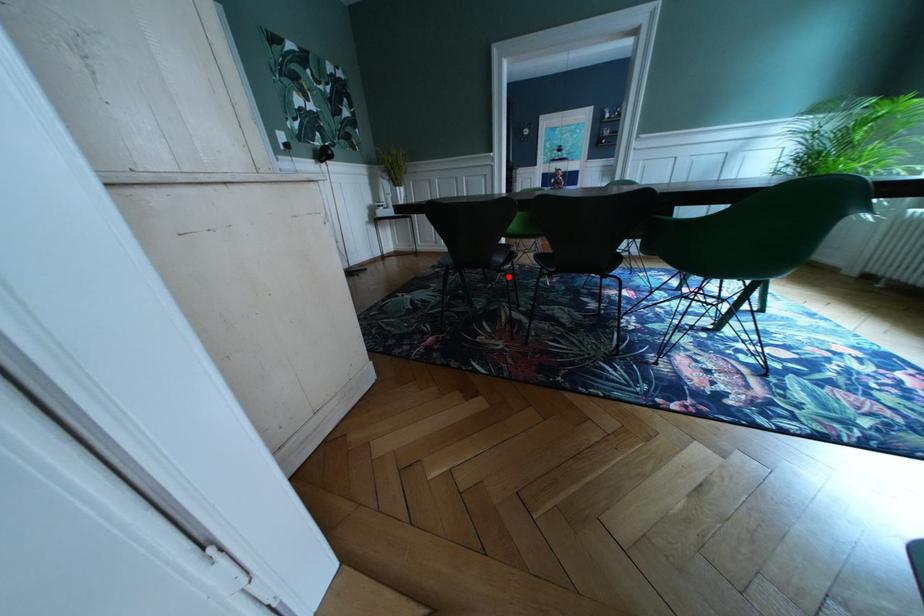
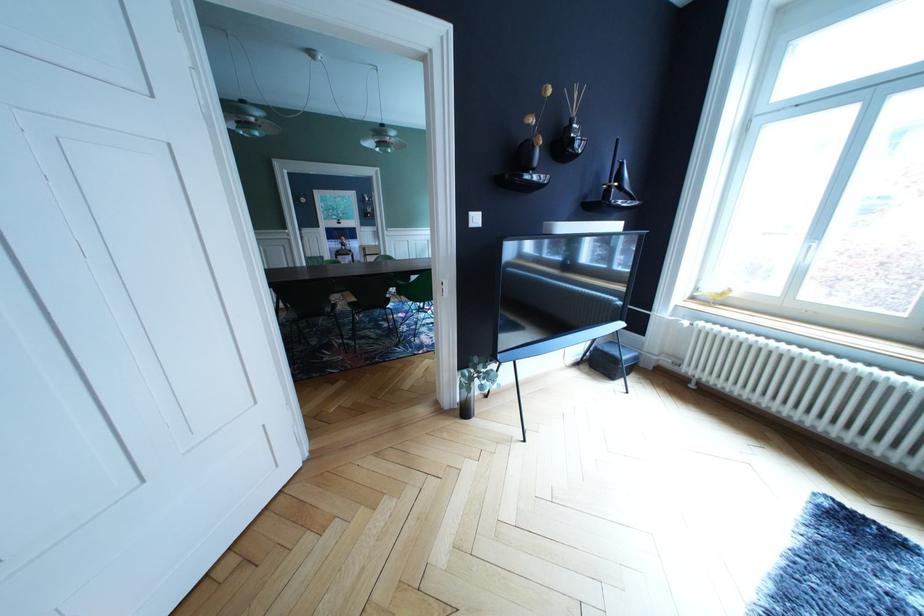
Find the pixel in the second image that matches the highlighted location in the first image.

(338, 322)